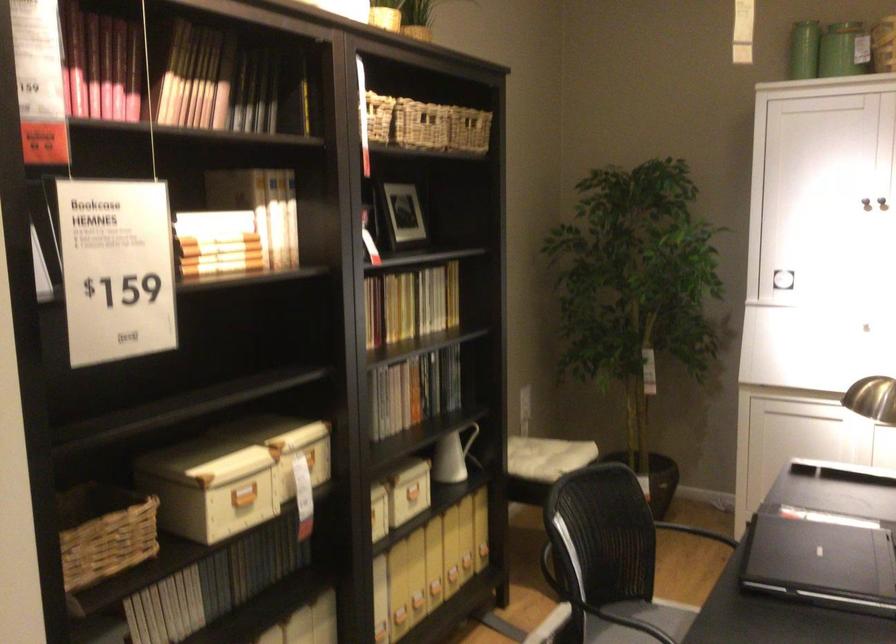
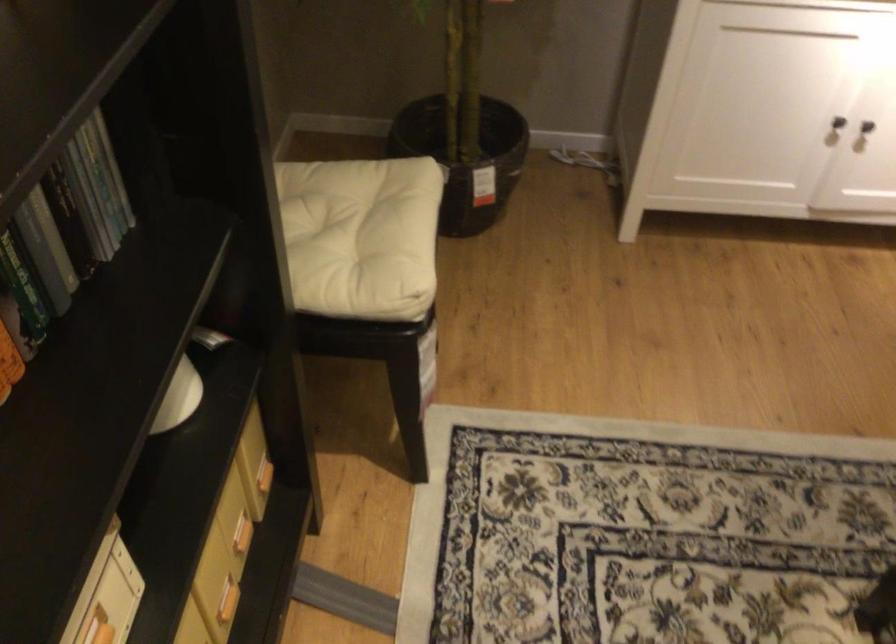
Locate, in the second image, the point that corresponds to [446,390] in the first image.

(95, 198)